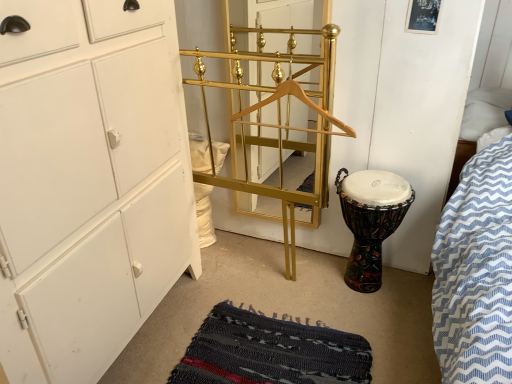
Question: Considering the positions of multicolored painted drum at lower right and gold metallic coat rack at center in the image, is multicolored painted drum at lower right taller or shorter than gold metallic coat rack at center?

Choices:
 (A) tall
 (B) short

Answer: (B)

Question: In terms of width, does multicolored painted drum at lower right look wider or thinner when compared to gold metallic coat rack at center?

Choices:
 (A) wide
 (B) thin

Answer: (A)

Question: Based on their relative distances, which object is farther from the wooden hanger at center?

Choices:
 (A) gold metallic coat rack at center
 (B) white matte cabinet at left
 (C) rag-textured mat at lower center
 (D) gold/metallic coat rack at center
 (E) multicolored painted drum at lower right

Answer: (C)

Question: Estimate the real-world distances between objects in this image. Which object is farther from the gold/metallic coat rack at center?

Choices:
 (A) white matte cabinet at left
 (B) wooden hanger at center
 (C) gold metallic coat rack at center
 (D) rag-textured mat at lower center
 (E) multicolored painted drum at lower right

Answer: (D)